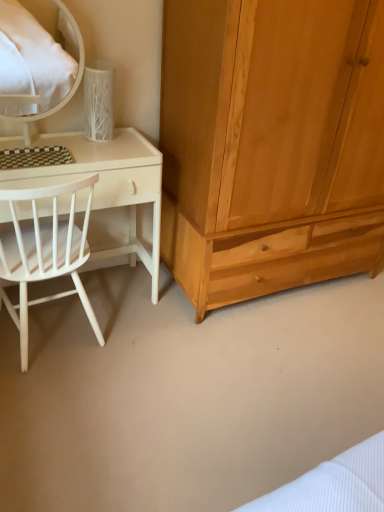
Question: Is point (367, 59) positioned closer to the camera than point (64, 291)?

Choices:
 (A) farther
 (B) closer

Answer: (B)

Question: Is natural wood wardrobe at right situated inside white wood chair at left or outside?

Choices:
 (A) outside
 (B) inside

Answer: (A)

Question: Which object is the farthest from the white wood chair at left?

Choices:
 (A) natural wood wardrobe at right
 (B) white glossy mirror at upper left
 (C) white matte desk at left

Answer: (B)

Question: Which object is the closest to the white glossy mirror at upper left?

Choices:
 (A) white wood chair at left
 (B) white matte desk at left
 (C) natural wood wardrobe at right

Answer: (B)